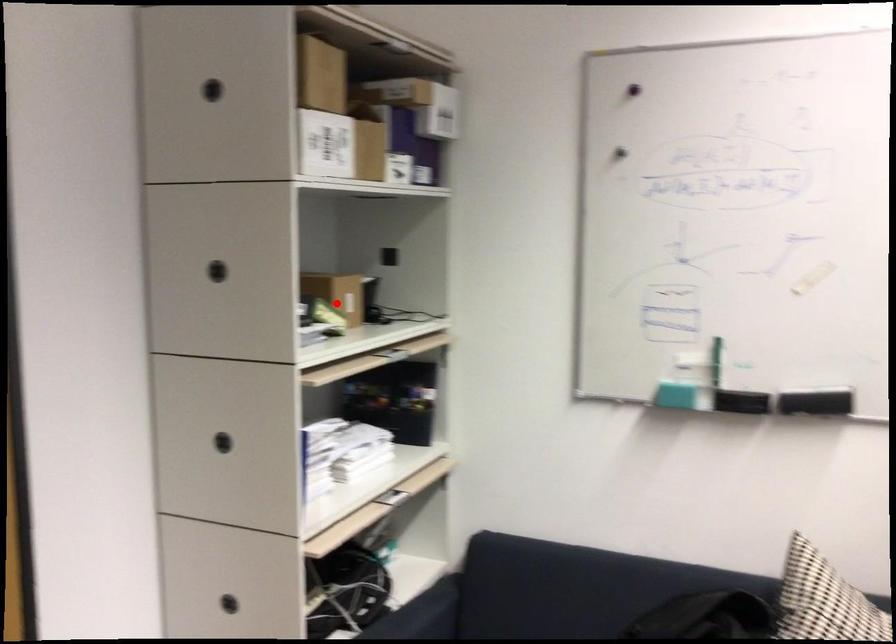
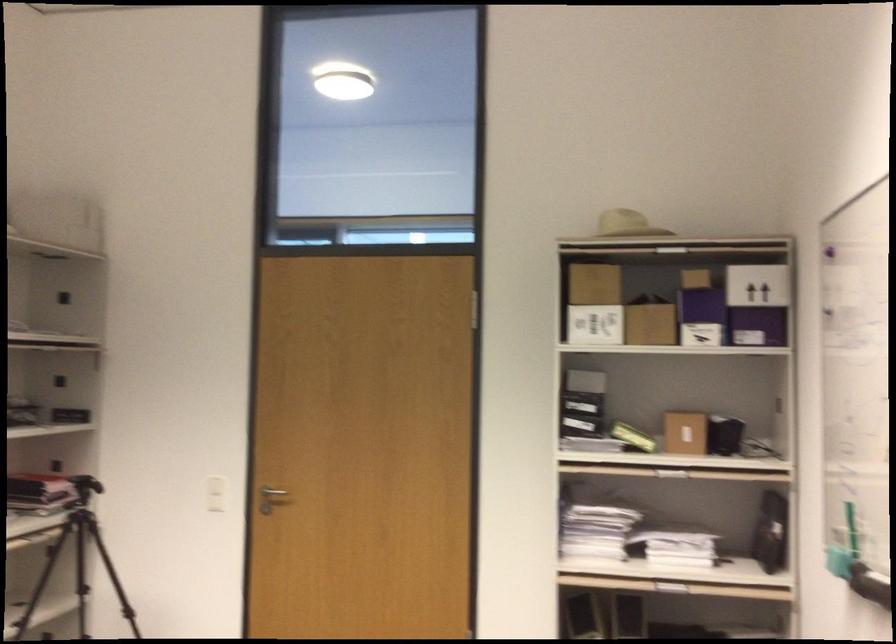
Question: I am providing you with two images of the same scene from different viewpoints. Image1 has a red point marked. In image2, the corresponding 3D location appears at what relative position? Reply with the corresponding letter.

Choices:
 (A) Closer
 (B) Farther

Answer: (B)